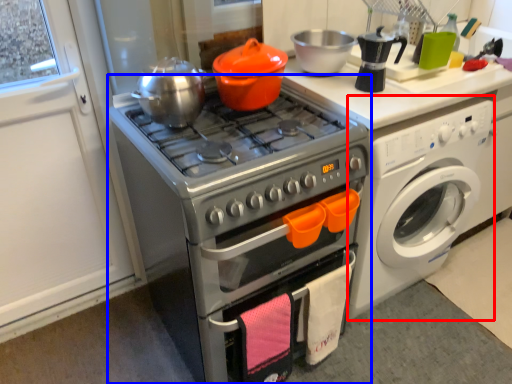
Question: Which point is further to the camera, washing machine (highlighted by a red box) or oven (highlighted by a blue box)?

Choices:
 (A) washing machine
 (B) oven

Answer: (A)